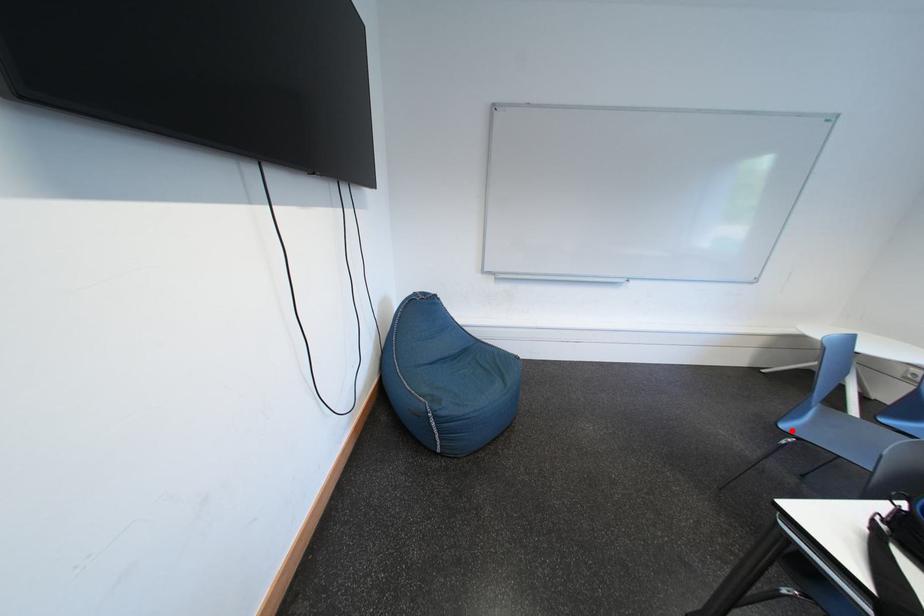
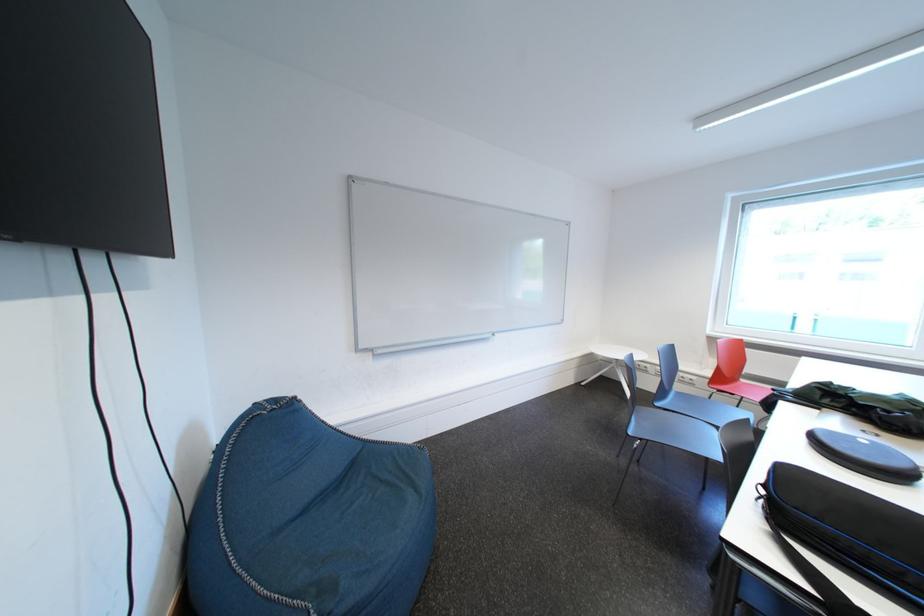
Where in the second image is the point corresponding to the highlighted location from the first image?

(639, 437)